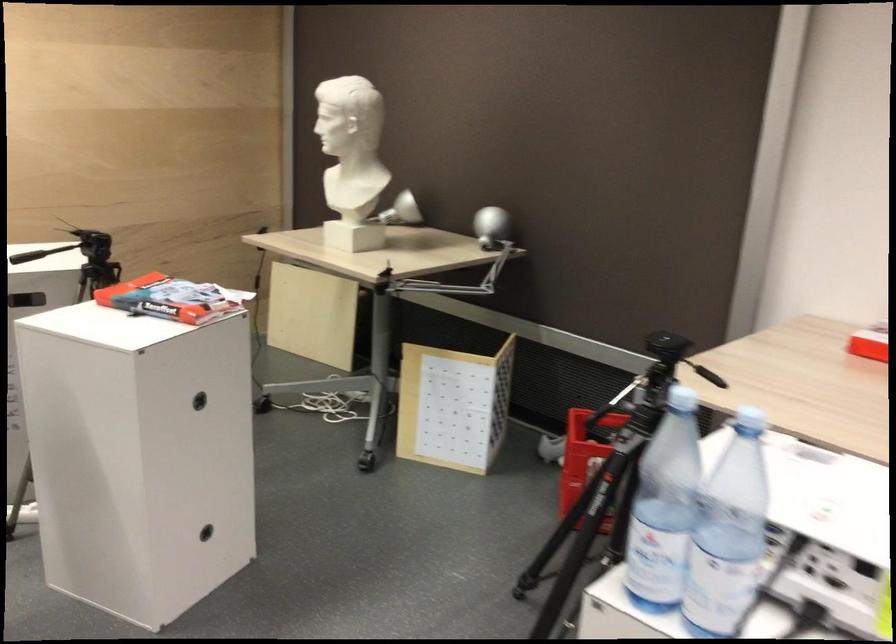
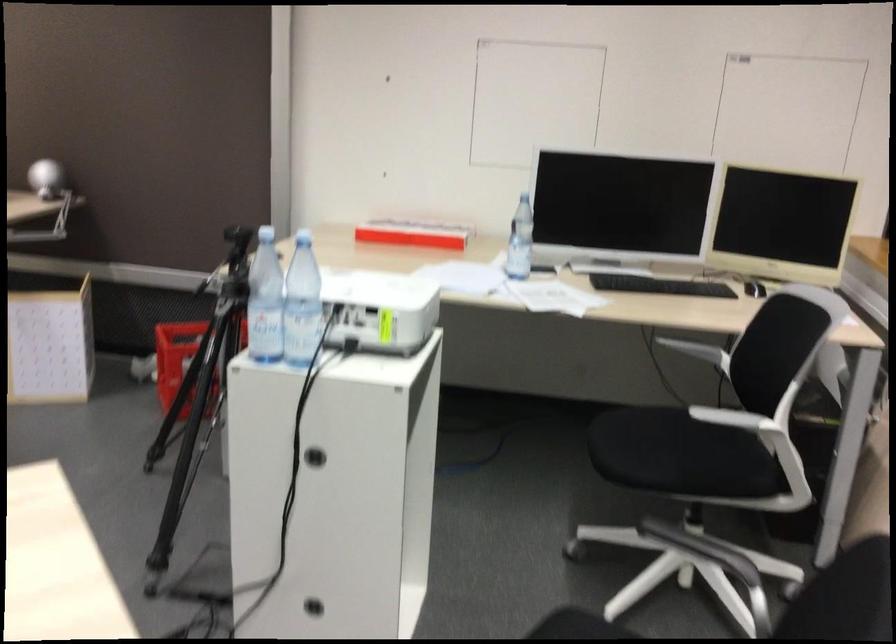
The point at (583, 547) is marked in the first image. Where is the corresponding point in the second image?

(200, 393)